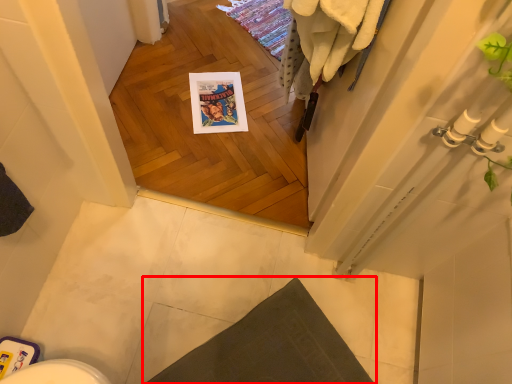
Question: From the image's perspective, what is the correct spatial relationship of bath mat (annotated by the red box) in relation to bath towel?

Choices:
 (A) above
 (B) below

Answer: (B)